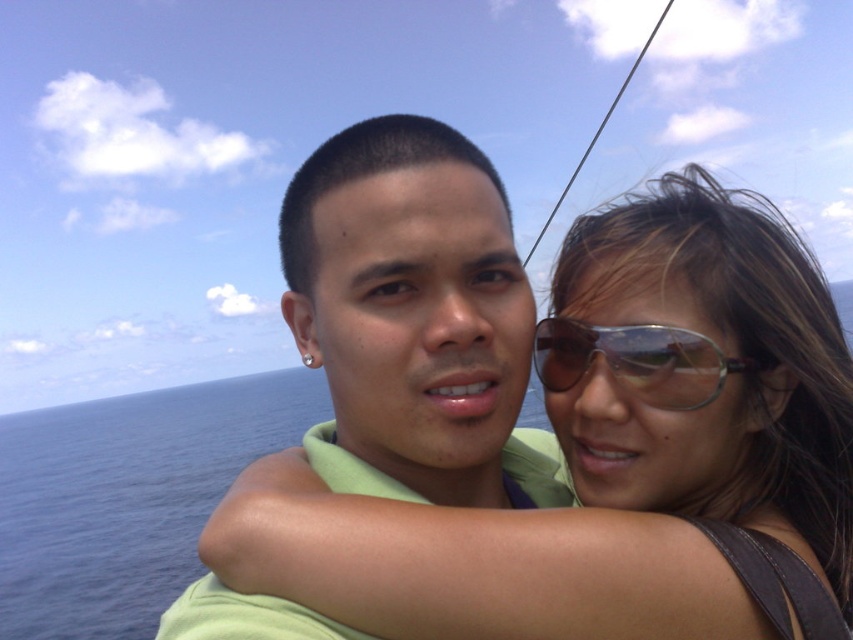
Question: Is matte green shirt at center closer to camera compared to sunglasses at center?

Choices:
 (A) no
 (B) yes

Answer: (B)

Question: Which object appears closest to the camera in this image?

Choices:
 (A) sunglasses at center
 (B) matte green shirt at center

Answer: (B)

Question: Among these points, which one is nearest to the camera?

Choices:
 (A) (663, 392)
 (B) (366, 250)

Answer: (B)

Question: Does matte green shirt at center have a greater width compared to sunglasses at center?

Choices:
 (A) yes
 (B) no

Answer: (A)

Question: In this image, where is matte green shirt at center located relative to sunglasses at center?

Choices:
 (A) above
 (B) below

Answer: (B)